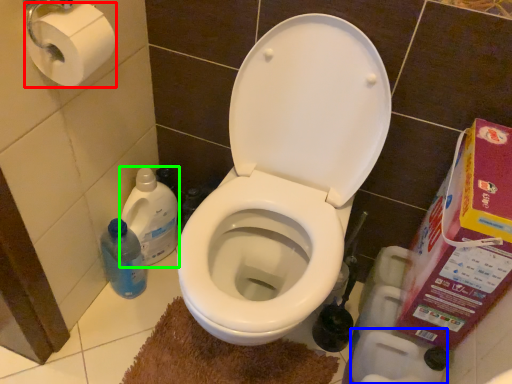
Question: Considering the real-world distances, which object is farthest from toilet paper (highlighted by a red box)? toilet paper (highlighted by a blue box) or cleaning product (highlighted by a green box)?

Choices:
 (A) toilet paper
 (B) cleaning product

Answer: (A)